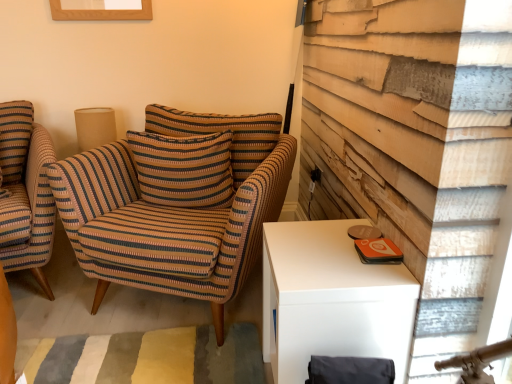
What is the approximate width of striped fabric pillow at center?

The width of striped fabric pillow at center is 25.40 centimeters.

What do you see at coordinates (184, 169) in the screenshot?
I see `striped fabric pillow at center` at bounding box center [184, 169].

Locate an element on the screen. burlap lampshade at upper left is located at coordinates (94, 127).

Find the location of `striped fabric armchair at center, the second chair when ordered from left to right`. striped fabric armchair at center, the second chair when ordered from left to right is located at coordinates (176, 203).

In order to click on striped fabric pillow at center in this screenshot , I will do `click(184, 169)`.

Does striped fabric armchair at left, which is the second chair in right-to-left order, appear on the right side of striped fabric armchair at center, acting as the first chair starting from the right?

No.

Considering the sizes of objects striped fabric armchair at left, which is the second chair in right-to-left order, and striped fabric armchair at center, acting as the first chair starting from the right, in the image provided, who is taller, striped fabric armchair at left, which is the second chair in right-to-left order, or striped fabric armchair at center, acting as the first chair starting from the right,?

Standing taller between the two is striped fabric armchair at left, which is the second chair in right-to-left order.

Is striped fabric armchair at left, which is the second chair in right-to-left order, positioned with its back to striped fabric armchair at center, acting as the first chair starting from the right?

No.

Is striped fabric armchair at left, which is the second chair in right-to-left order, closer to camera compared to striped fabric armchair at center, acting as the first chair starting from the right?

No, the depth of striped fabric armchair at left, which is the second chair in right-to-left order, is greater than that of striped fabric armchair at center, acting as the first chair starting from the right.

From a real-world perspective, relative to burlap lampshade at upper left, is striped fabric armchair at center, acting as the first chair starting from the right, vertically above or below?

From a real-world perspective, striped fabric armchair at center, acting as the first chair starting from the right, is physically below burlap lampshade at upper left.

In the scene shown: From the image's perspective, does striped fabric armchair at center, the second chair when ordered from left to right, appear lower than burlap lampshade at upper left?

Indeed, from the image's perspective, striped fabric armchair at center, the second chair when ordered from left to right, is shown beneath burlap lampshade at upper left.

Which is behind, point (279, 177) or point (85, 147)?

The point (85, 147) is more distant.

Is striped fabric armchair at center, acting as the first chair starting from the right, not inside burlap lampshade at upper left?

Indeed, striped fabric armchair at center, acting as the first chair starting from the right, is completely outside burlap lampshade at upper left.

Considering the relative sizes of burlap lampshade at upper left and striped fabric armchair at center, acting as the first chair starting from the right, in the image provided, is burlap lampshade at upper left wider than striped fabric armchair at center, acting as the first chair starting from the right,?

In fact, burlap lampshade at upper left might be narrower than striped fabric armchair at center, acting as the first chair starting from the right.

From a real-world perspective, which chair is the 1st one underneath the burlap lampshade at upper left? Please provide its 2D coordinates.

[(176, 203)]

Is point (98, 129) closer to viewer compared to point (126, 229)?

No, (98, 129) is behind (126, 229).

What's the angular difference between burlap lampshade at upper left and striped fabric armchair at center, acting as the first chair starting from the right,'s facing directions?

burlap lampshade at upper left and striped fabric armchair at center, acting as the first chair starting from the right, are facing 22.6 degrees away from each other.

Is striped fabric pillow at center at the back of striped fabric armchair at center, acting as the first chair starting from the right?

Correct, striped fabric armchair at center, acting as the first chair starting from the right, is looking away from striped fabric pillow at center.

Is striped fabric armchair at center, the second chair when ordered from left to right, not near striped fabric pillow at center?

Actually, striped fabric armchair at center, the second chair when ordered from left to right, and striped fabric pillow at center are a little close together.

How many degrees apart are the facing directions of striped fabric armchair at center, the second chair when ordered from left to right, and striped fabric pillow at center?

13.8 degrees.

Locate an element on the screen. pillow beneath the burlap lampshade at upper left (from a real-world perspective) is located at coordinates (184, 169).

Considering the sizes of objects burlap lampshade at upper left and striped fabric pillow at center in the image provided, who is taller, burlap lampshade at upper left or striped fabric pillow at center?

striped fabric pillow at center is taller.

Based on the photo, from a real-world perspective, is burlap lampshade at upper left positioned over striped fabric pillow at center based on gravity?

Yes.

Can you tell me how much burlap lampshade at upper left and striped fabric pillow at center differ in facing direction?

8.79 degrees.

From the image's perspective, who appears lower, burlap lampshade at upper left or striped fabric armchair at left, arranged as the first chair when viewed from the left?

striped fabric armchair at left, arranged as the first chair when viewed from the left, from the image's perspective.

From a real-world perspective, between burlap lampshade at upper left and striped fabric armchair at left, arranged as the first chair when viewed from the left, who is vertically higher?

From a 3D spatial view, burlap lampshade at upper left is above.

Between point (113, 135) and point (5, 178), which one is positioned behind?

The point (113, 135) is more distant.

Is burlap lampshade at upper left inside the boundaries of striped fabric armchair at left, which is the second chair in right-to-left order, or outside?

burlap lampshade at upper left is outside striped fabric armchair at left, which is the second chair in right-to-left order.

How different are the orientations of striped fabric pillow at center and striped fabric armchair at left, which is the second chair in right-to-left order, in degrees?

They differ by 32.3 degrees in their facing directions.

Does point (205, 160) lie behind point (42, 199)?

No, (205, 160) is in front of (42, 199).

Could you tell me if striped fabric pillow at center is facing striped fabric armchair at left, arranged as the first chair when viewed from the left?

No, striped fabric pillow at center is not oriented towards striped fabric armchair at left, arranged as the first chair when viewed from the left.

You are a GUI agent. You are given a task and a screenshot of the screen. Output one action in this format:
    pyautogui.click(x=<x>, y=<y>)
    Task: Click on the pillow above the striped fabric armchair at left, arranged as the first chair when viewed from the left (from a real-world perspective)
    The height and width of the screenshot is (384, 512).
    Given the screenshot: What is the action you would take?
    pyautogui.click(x=184, y=169)

This screenshot has width=512, height=384. Identify the location of chair lying on the left of striped fabric armchair at center, acting as the first chair starting from the right. (25, 192).

At what (x,y) coordinates should I click in order to perform the action: click on lamp that is above the striped fabric armchair at center, the second chair when ordered from left to right (from the image's perspective). Please return your answer as a coordinate pair (x, y). Image resolution: width=512 pixels, height=384 pixels. Looking at the image, I should click on (94, 127).

Based on their spatial positions, is burlap lampshade at upper left or striped fabric pillow at center further from striped fabric armchair at left, which is the second chair in right-to-left order?

The object further to striped fabric armchair at left, which is the second chair in right-to-left order, is striped fabric pillow at center.

Based on their spatial positions, is striped fabric armchair at left, arranged as the first chair when viewed from the left, or striped fabric pillow at center closer to burlap lampshade at upper left?

striped fabric armchair at left, arranged as the first chair when viewed from the left.

Which object lies nearer to the anchor point striped fabric armchair at center, acting as the first chair starting from the right, burlap lampshade at upper left or striped fabric pillow at center?

striped fabric pillow at center lies closer to striped fabric armchair at center, acting as the first chair starting from the right, than the other object.

Considering their positions, is striped fabric pillow at center positioned closer to striped fabric armchair at left, arranged as the first chair when viewed from the left, than burlap lampshade at upper left?

Among the two, burlap lampshade at upper left is located nearer to striped fabric armchair at left, arranged as the first chair when viewed from the left.

Based on their spatial positions, is striped fabric pillow at center or striped fabric armchair at center, acting as the first chair starting from the right, closer to striped fabric armchair at left, which is the second chair in right-to-left order?

striped fabric armchair at center, acting as the first chair starting from the right, is closer to striped fabric armchair at left, which is the second chair in right-to-left order.

Looking at the image, which one is located further to burlap lampshade at upper left, striped fabric armchair at center, acting as the first chair starting from the right, or striped fabric pillow at center?

striped fabric armchair at center, acting as the first chair starting from the right, lies further to burlap lampshade at upper left than the other object.

When comparing their distances from striped fabric armchair at center, the second chair when ordered from left to right, does striped fabric armchair at left, arranged as the first chair when viewed from the left, or burlap lampshade at upper left seem further?

Among the two, burlap lampshade at upper left is located further to striped fabric armchair at center, the second chair when ordered from left to right.

Based on their spatial positions, is striped fabric pillow at center or burlap lampshade at upper left further from striped fabric armchair at center, acting as the first chair starting from the right?

burlap lampshade at upper left is positioned further to the anchor striped fabric armchair at center, acting as the first chair starting from the right.

Locate an element on the screen. The height and width of the screenshot is (384, 512). lamp between striped fabric armchair at left, arranged as the first chair when viewed from the left, and striped fabric pillow at center is located at coordinates (94, 127).

This screenshot has height=384, width=512. In order to click on pillow positioned between striped fabric armchair at center, the second chair when ordered from left to right, and burlap lampshade at upper left from near to far in this screenshot , I will do `click(184, 169)`.

I want to click on pillow between striped fabric armchair at left, arranged as the first chair when viewed from the left, and striped fabric armchair at center, acting as the first chair starting from the right, so click(x=184, y=169).

Identify the location of lamp between striped fabric armchair at left, which is the second chair in right-to-left order, and striped fabric armchair at center, the second chair when ordered from left to right, from left to right. The image size is (512, 384). (94, 127).